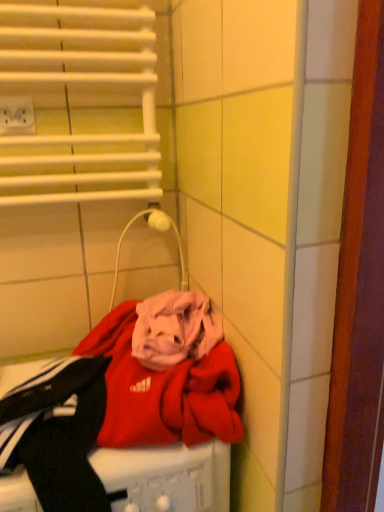
Question: From a real-world perspective, is red fabric washing machine at lower left above or below white plastic outlet at upper left?

Choices:
 (A) below
 (B) above

Answer: (A)

Question: In terms of size, does red fabric washing machine at lower left appear bigger or smaller than white plastic outlet at upper left?

Choices:
 (A) big
 (B) small

Answer: (A)

Question: In terms of width, does red fabric washing machine at lower left look wider or thinner when compared to white plastic outlet at upper left?

Choices:
 (A) wide
 (B) thin

Answer: (A)

Question: Considering the positions of point 33,124 and point 182,480, is point 33,124 closer or farther from the camera than point 182,480?

Choices:
 (A) closer
 (B) farther

Answer: (B)

Question: Considering the positions of white plastic outlet at upper left and red fabric washing machine at lower left in the image, is white plastic outlet at upper left wider or thinner than red fabric washing machine at lower left?

Choices:
 (A) wide
 (B) thin

Answer: (B)

Question: Visually, is white plastic outlet at upper left positioned to the left or to the right of red fabric washing machine at lower left?

Choices:
 (A) right
 (B) left

Answer: (B)

Question: Based on their sizes in the image, would you say white plastic outlet at upper left is bigger or smaller than red fabric washing machine at lower left?

Choices:
 (A) big
 (B) small

Answer: (B)